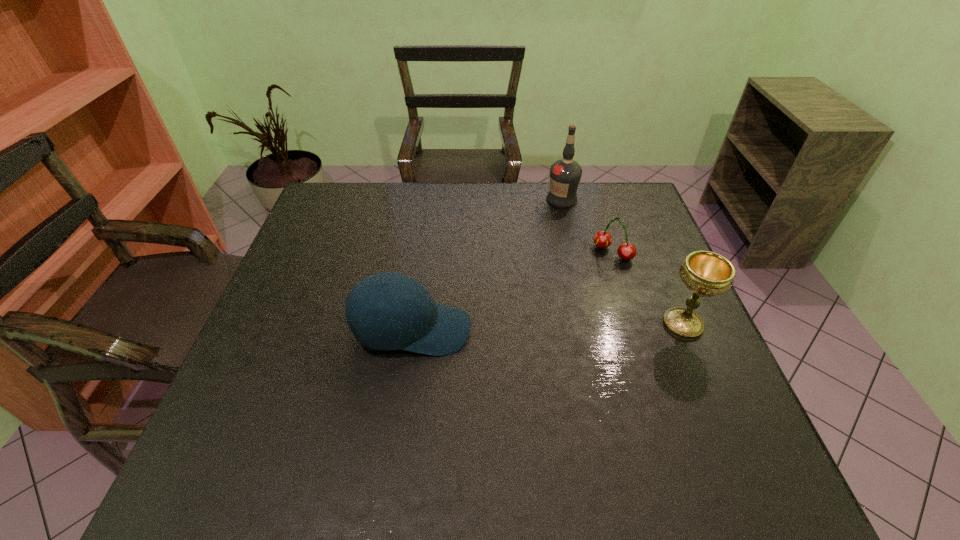
Find the location of a particular element. The image size is (960, 540). free space at the near edge of the desktop is located at coordinates (427, 420).

Where is `vacant region at the left edge of the desktop`? This screenshot has height=540, width=960. vacant region at the left edge of the desktop is located at coordinates (288, 324).

Identify the location of vacant space at the right edge of the desktop. The width and height of the screenshot is (960, 540). (685, 390).

Find the location of a particular element. The height and width of the screenshot is (540, 960). vacant space in between the chalice and the leftmost object is located at coordinates (547, 327).

Locate an element on the screen. The height and width of the screenshot is (540, 960). free space between the second farthest object and the rightmost object is located at coordinates (648, 288).

Where is `unoccupied position between the third tallest object and the chalice`? The image size is (960, 540). unoccupied position between the third tallest object and the chalice is located at coordinates (547, 327).

You are a GUI agent. You are given a task and a screenshot of the screen. Output one action in this format:
    pyautogui.click(x=<x>, y=<y>)
    Task: Click on the free space between the baseball cap and the rightmost object
    The width and height of the screenshot is (960, 540).
    Given the screenshot: What is the action you would take?
    pyautogui.click(x=547, y=327)

Find the location of `free space between the third object from left to right and the second object from left to right`. free space between the third object from left to right and the second object from left to right is located at coordinates (588, 226).

The height and width of the screenshot is (540, 960). Find the location of `vacant space that's between the vodka and the shortest object`. vacant space that's between the vodka and the shortest object is located at coordinates (588, 226).

Identify the location of vacant space that is in between the leftmost object and the chalice. Image resolution: width=960 pixels, height=540 pixels. (547, 327).